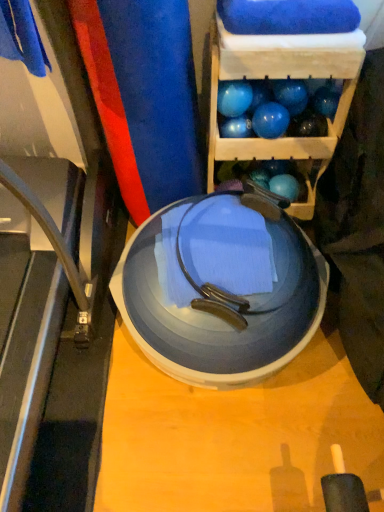
Question: From a real-world perspective, is glossy blue ball at upper center, positioned as the third ball in right-to-left order, positioned over metallic gray treadmill at lower left based on gravity?

Choices:
 (A) no
 (B) yes

Answer: (B)

Question: Is glossy blue ball at upper center, acting as the second ball starting from the left, bigger than metallic gray treadmill at lower left?

Choices:
 (A) no
 (B) yes

Answer: (A)

Question: Is glossy blue ball at upper center, positioned as the third ball in right-to-left order, positioned far away from metallic gray treadmill at lower left?

Choices:
 (A) yes
 (B) no

Answer: (B)

Question: Can you confirm if glossy blue ball at upper center, positioned as the third ball in right-to-left order, is taller than metallic gray treadmill at lower left?

Choices:
 (A) no
 (B) yes

Answer: (B)

Question: Can you confirm if glossy blue ball at upper center, positioned as the third ball in right-to-left order, is positioned to the right of metallic gray treadmill at lower left?

Choices:
 (A) yes
 (B) no

Answer: (A)

Question: Do you think transparent plastic plate at center is within metallic gray treadmill at lower left, or outside of it?

Choices:
 (A) inside
 (B) outside

Answer: (B)

Question: From the image's perspective, relative to metallic gray treadmill at lower left, is transparent plastic plate at center above or below?

Choices:
 (A) above
 (B) below

Answer: (A)

Question: Relative to metallic gray treadmill at lower left, is transparent plastic plate at center in front or behind?

Choices:
 (A) behind
 (B) front

Answer: (B)

Question: Is transparent plastic plate at center bigger or smaller than metallic gray treadmill at lower left?

Choices:
 (A) big
 (B) small

Answer: (A)

Question: From the image's perspective, is blue rubber balloon at upper right positioned above or below blue rubber ball at upper right, which appears as the 1th ball when viewed from the right?

Choices:
 (A) below
 (B) above

Answer: (B)

Question: In the image, is blue rubber balloon at upper right on the left side or the right side of blue rubber ball at upper right, which appears as the 1th ball when viewed from the right?

Choices:
 (A) right
 (B) left

Answer: (A)

Question: Is blue rubber balloon at upper right in front of or behind blue rubber ball at upper right, the fourth ball from the left, in the image?

Choices:
 (A) front
 (B) behind

Answer: (B)

Question: Considering the positions of blue rubber balloon at upper right and blue rubber ball at upper right, the fourth ball from the left, in the image, is blue rubber balloon at upper right bigger or smaller than blue rubber ball at upper right, the fourth ball from the left,?

Choices:
 (A) big
 (B) small

Answer: (B)

Question: From the image's perspective, is blue rubber balloon at upper right located above or below transparent plastic plate at center?

Choices:
 (A) above
 (B) below

Answer: (A)

Question: In the image, is blue rubber balloon at upper right on the left side or the right side of transparent plastic plate at center?

Choices:
 (A) right
 (B) left

Answer: (A)